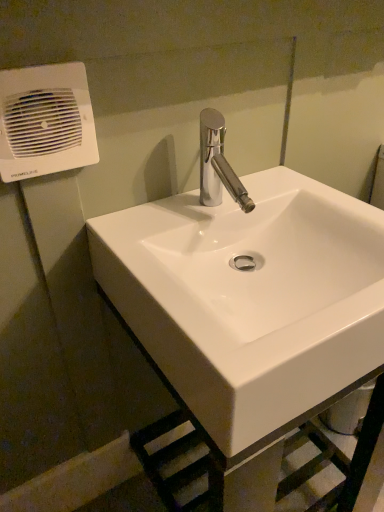
The height and width of the screenshot is (512, 384). What do you see at coordinates (45, 121) in the screenshot?
I see `white plastic air conditioning at upper left` at bounding box center [45, 121].

Locate an element on the screen. The image size is (384, 512). white plastic air conditioning at upper left is located at coordinates (45, 121).

Locate an element on the screen. white glossy sink at center is located at coordinates (249, 293).

Image resolution: width=384 pixels, height=512 pixels. What do you see at coordinates (249, 293) in the screenshot?
I see `white glossy sink at center` at bounding box center [249, 293].

Locate an element on the screen. This screenshot has height=512, width=384. white plastic air conditioning at upper left is located at coordinates (45, 121).

Considering the positions of objects white plastic air conditioning at upper left and white glossy sink at center in the image provided, who is more to the left, white plastic air conditioning at upper left or white glossy sink at center?

From the viewer's perspective, white plastic air conditioning at upper left appears more on the left side.

Is white plastic air conditioning at upper left positioned in front of white glossy sink at center?

That is False.

Which is behind, point (38, 93) or point (172, 339)?

The point (38, 93) is behind.

From the image's perspective, is white plastic air conditioning at upper left on white glossy sink at center?

Yes, from the image's perspective, white plastic air conditioning at upper left is over white glossy sink at center.

From a real-world perspective, is white plastic air conditioning at upper left beneath white glossy sink at center?

No, from a real-world perspective, white plastic air conditioning at upper left is not under white glossy sink at center.

Which of these two, white plastic air conditioning at upper left or white glossy sink at center, is thinner?

With smaller width is white plastic air conditioning at upper left.

Considering the sizes of objects white plastic air conditioning at upper left and white glossy sink at center in the image provided, who is taller, white plastic air conditioning at upper left or white glossy sink at center?

white glossy sink at center is taller.

Can you confirm if white plastic air conditioning at upper left is smaller than white glossy sink at center?

Yes.

Based on the photo, is white plastic air conditioning at upper left spatially inside white glossy sink at center, or outside of it?

white plastic air conditioning at upper left exists outside the volume of white glossy sink at center.

Are white plastic air conditioning at upper left and white glossy sink at center beside each other?

white plastic air conditioning at upper left and white glossy sink at center are not in contact.

Could you tell me if white plastic air conditioning at upper left is turned towards white glossy sink at center?

No, white plastic air conditioning at upper left is not turned towards white glossy sink at center.

Can you tell me how much white plastic air conditioning at upper left and white glossy sink at center differ in facing direction?

They differ by 0.0031 degrees in their facing directions.

Measure the distance between white plastic air conditioning at upper left and white glossy sink at center.

white plastic air conditioning at upper left is 13.43 inches from white glossy sink at center.

Identify the location of air conditioning that appears above the white glossy sink at center (from the image's perspective). This screenshot has height=512, width=384. (45, 121).

Which object is positioned more to the left, white glossy sink at center or white plastic air conditioning at upper left?

From the viewer's perspective, white plastic air conditioning at upper left appears more on the left side.

Is white glossy sink at center in front of or behind white plastic air conditioning at upper left in the image?

Clearly, white glossy sink at center is in front of white plastic air conditioning at upper left.

Is point (287, 373) farther from camera compared to point (6, 72)?

No, it is in front of (6, 72).

From the image's perspective, between white glossy sink at center and white plastic air conditioning at upper left, who is located below?

From the image's view, white glossy sink at center is below.

Looking at this image, from a real-world perspective, who is located higher, white glossy sink at center or white plastic air conditioning at upper left?

From a 3D spatial view, white plastic air conditioning at upper left is above.

Considering the sizes of white glossy sink at center and white plastic air conditioning at upper left in the image, is white glossy sink at center wider or thinner than white plastic air conditioning at upper left?

In the image, white glossy sink at center appears to be wider than white plastic air conditioning at upper left.

Between white glossy sink at center and white plastic air conditioning at upper left, which one has less height?

Standing shorter between the two is white plastic air conditioning at upper left.

Between white glossy sink at center and white plastic air conditioning at upper left, which one has larger size?

Bigger between the two is white glossy sink at center.

Is white plastic air conditioning at upper left completely or partially inside white glossy sink at center?

Actually, white plastic air conditioning at upper left is outside white glossy sink at center.

Is white glossy sink at center next to white plastic air conditioning at upper left?

No.

Does white glossy sink at center turn towards white plastic air conditioning at upper left?

No, white glossy sink at center is not turned towards white plastic air conditioning at upper left.

What's the angular difference between white glossy sink at center and white plastic air conditioning at upper left's facing directions?

The facing directions of white glossy sink at center and white plastic air conditioning at upper left are 0.0031 degrees apart.

From the picture: How distant is white glossy sink at center from white plastic air conditioning at upper left?

white glossy sink at center is 13.43 inches from white plastic air conditioning at upper left.

Identify the location of air conditioning behind the white glossy sink at center. (45, 121).

You are a GUI agent. You are given a task and a screenshot of the screen. Output one action in this format:
    pyautogui.click(x=<x>, y=<y>)
    Task: Click on the air conditioning that appears above the white glossy sink at center (from the image's perspective)
    The width and height of the screenshot is (384, 512).
    Given the screenshot: What is the action you would take?
    [x=45, y=121]

In the image, there is a white plastic air conditioning at upper left. Where is `sink below it (from a real-world perspective)`? The width and height of the screenshot is (384, 512). sink below it (from a real-world perspective) is located at coordinates (249, 293).